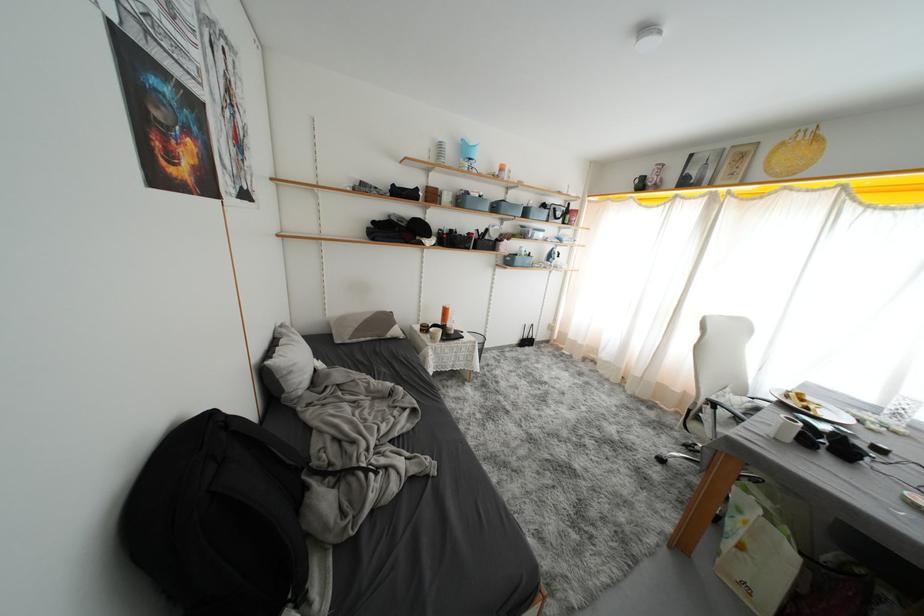
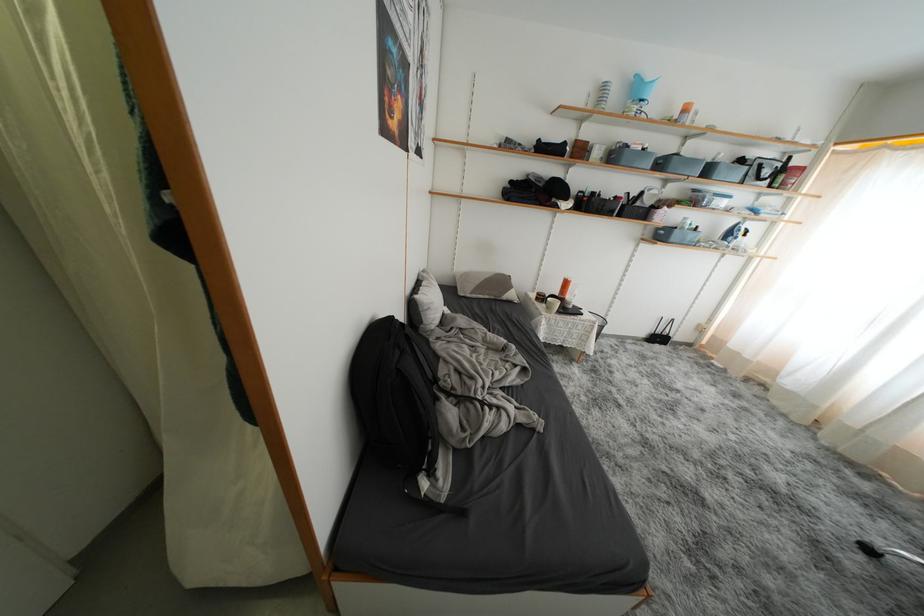
The point at (667, 464) is marked in the first image. Where is the corresponding point in the second image?

(876, 554)